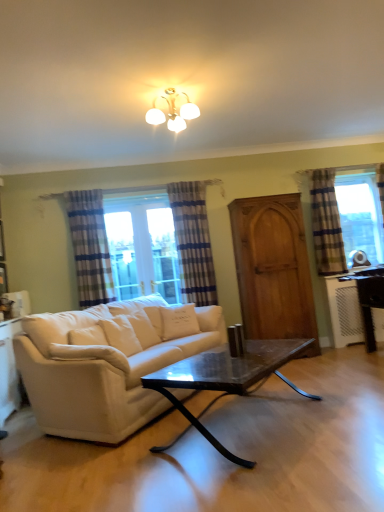
Where is `free spot above marble black coffee table at center (from a real-world perspective)`? The image size is (384, 512). free spot above marble black coffee table at center (from a real-world perspective) is located at coordinates pyautogui.click(x=237, y=357).